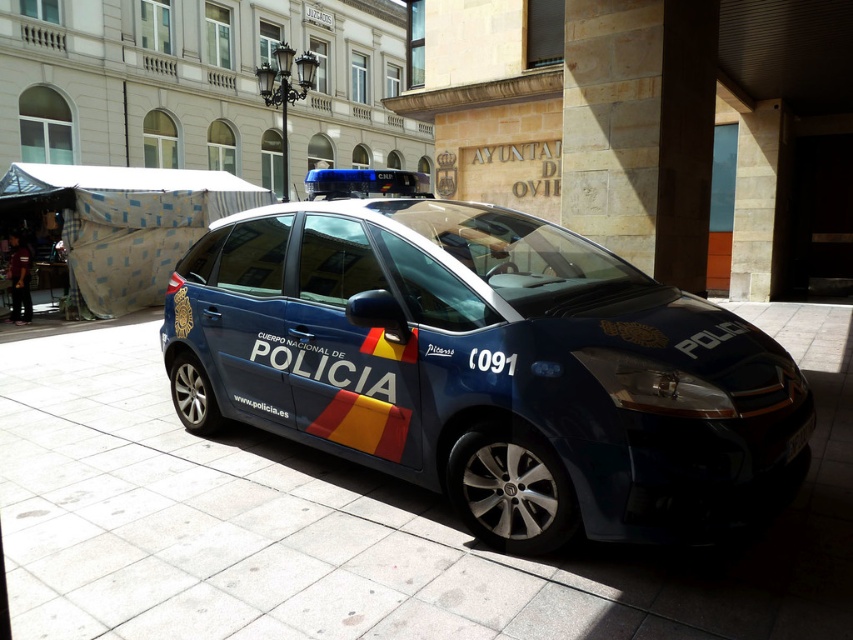
In the scene shown: You are a pedestrian standing on the slate gray pavement at center and want to cross the road to reach a nearby store. Is the glossy blue police car at center blocking your path?

The glossy blue police car at center is located above the slate gray pavement at center, so it is blocking your path.

You are a photographer who needs to capture the glossy blue police car at center and the black plastic license plate at lower right in a single frame. Given that the camera can only focus on objects within a 1.2 meter width, will both objects fit in the frame if they are positioned side by side?

The glossy blue police car at center is bigger than the black plastic license plate at lower right. Therefore, if placed side by side, the combined width of both objects would exceed the camera frame limit of 1.2 meters, making it impossible to capture both in a single frame.

You are a delivery person who needs to attach a package to the glossy blue police car at center. The package requires 5 feet of space between it and the black plastic license plate at lower right. Is there enough space?

The distance between the glossy blue police car at center and the black plastic license plate at lower right is 5.28 feet, so yes, there is enough space to attach the package since the required space is 5 feet.